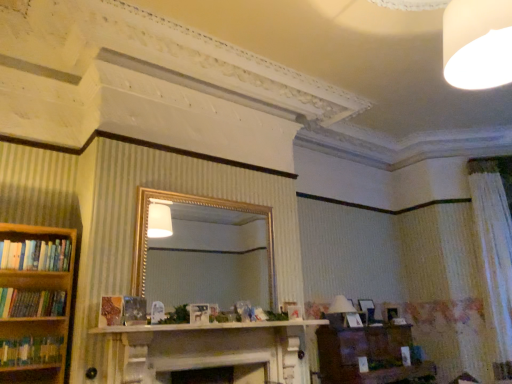
You are a GUI agent. You are given a task and a screenshot of the screen. Output one action in this format:
    pyautogui.click(x=<x>, y=<y>)
    Task: Click on the blank space above gold-framed mirror at center (from a real-world perspective)
    This screenshot has height=384, width=512.
    Given the screenshot: What is the action you would take?
    pyautogui.click(x=213, y=197)